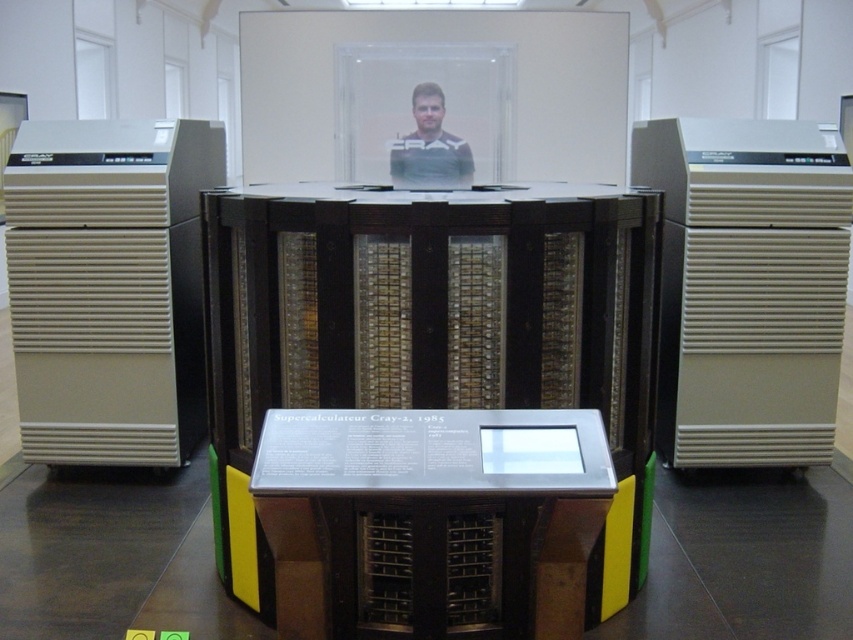
Does wooden paneling supercomputer at center appear over matte beige computer tower at left?

No.

Which is above, wooden paneling supercomputer at center or matte beige computer tower at left?

matte beige computer tower at left

Is point (276, 296) positioned behind point (157, 241)?

That is False.

Find the location of a particular element. This screenshot has width=853, height=640. wooden paneling supercomputer at center is located at coordinates (431, 333).

Can you confirm if wooden paneling supercomputer at center is wider than beige plastic computer tower at right?

Yes, wooden paneling supercomputer at center is wider than beige plastic computer tower at right.

Does wooden paneling supercomputer at center appear on the right side of beige plastic computer tower at right?

No, wooden paneling supercomputer at center is not to the right of beige plastic computer tower at right.

Is point (222, 236) farther from camera compared to point (834, 173)?

No, it is in front of (834, 173).

Identify the location of wooden paneling supercomputer at center. This screenshot has height=640, width=853. coord(431,333).

Does matte beige computer tower at left have a lesser height compared to metallic/textured display at center?

No, matte beige computer tower at left is not shorter than metallic/textured display at center.

Is matte beige computer tower at left below metallic/textured display at center?

No.

Which is behind, point (91, 182) or point (265, 502)?

The point (91, 182) is behind.

At what (x,y) coordinates should I click in order to perform the action: click on matte beige computer tower at left. Please return your answer as a coordinate pair (x, y). This screenshot has width=853, height=640. Looking at the image, I should click on (108, 285).